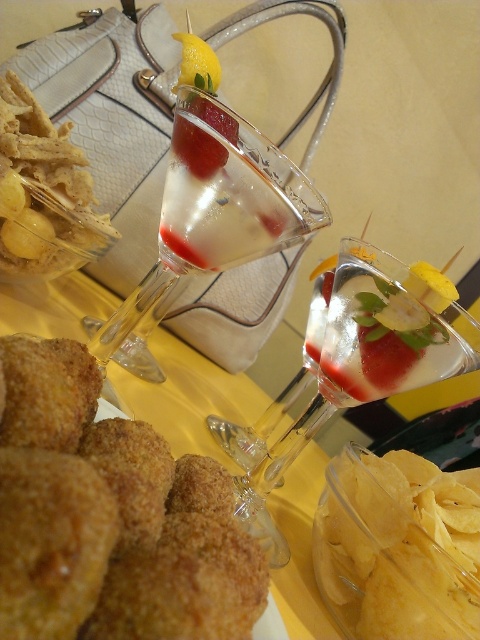
Question: From the image, what is the correct spatial relationship of golden crispy croquettes at lower left in relation to golden crispy chips at lower right?

Choices:
 (A) left
 (B) right

Answer: (A)

Question: Is golden crispy croquettes at lower left further to camera compared to yellow citrus at center?

Choices:
 (A) no
 (B) yes

Answer: (A)

Question: Which object appears farthest from the camera in this image?

Choices:
 (A) matte red wine at center
 (B) golden fried nuggets at lower left
 (C) translucent glass cocktail at center
 (D) golden crispy croquettes at lower left

Answer: (B)

Question: Which point is closer to the camera taking this photo?

Choices:
 (A) (349, 296)
 (B) (371, 627)

Answer: (B)

Question: Based on their relative distances, which object is nearer to the clear glass cocktail at center?

Choices:
 (A) golden crispy chips at lower right
 (B) yellow citrus at center

Answer: (B)

Question: Does clear glass cocktail at center appear on the right side of matte red wine at center?

Choices:
 (A) no
 (B) yes

Answer: (A)